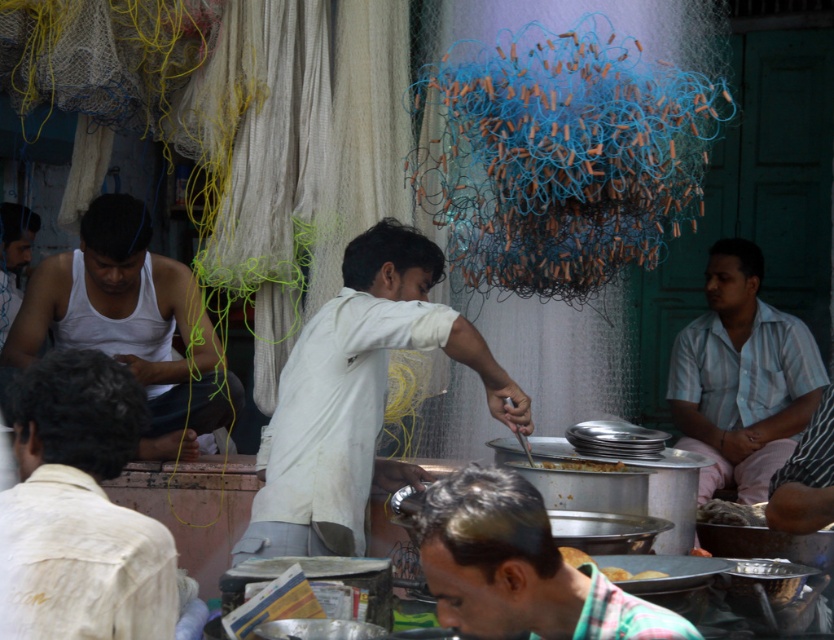
You are a customer at the food stall and want to choose between the golden brown bread at center and the yellow matte bread at center. Which one is taller?

The golden brown bread at center is taller than the yellow matte bread at center.